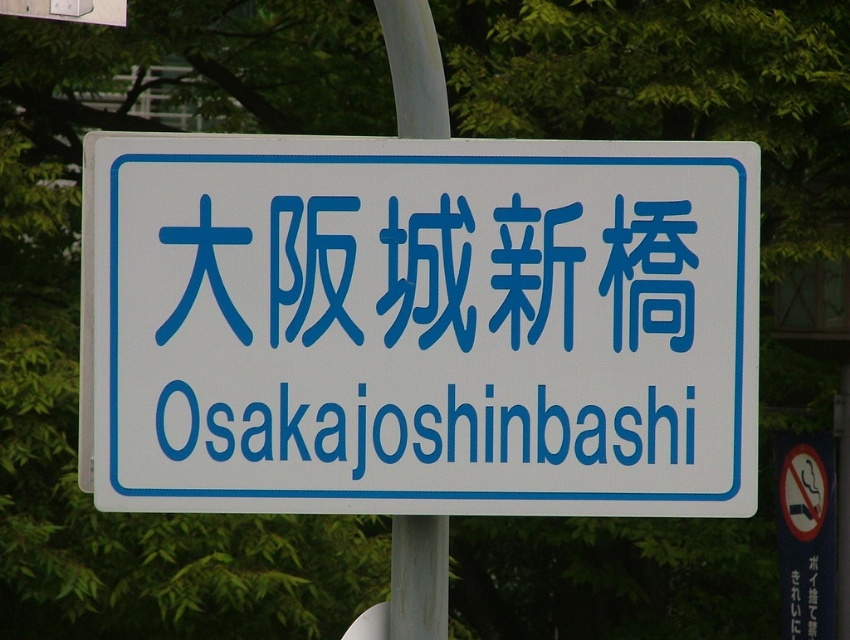
Question: Based on their relative distances, which object is farther from the white plastic signboard at center?

Choices:
 (A) bluematerial/texturetext at center
 (B) metallic gray pole at center
 (C) blue plastic sign at center

Answer: (C)

Question: Which point is closer to the camera?

Choices:
 (A) metallic gray pole at center
 (B) blue plastic sign at center
 (C) bluematerial/texturetext at center
 (D) white plastic signboard at center

Answer: (D)

Question: Does metallic gray pole at center have a lesser width compared to blue plastic sign at center?

Choices:
 (A) yes
 (B) no

Answer: (A)

Question: Which object appears closest to the camera in this image?

Choices:
 (A) white plastic signboard at center
 (B) blue plastic sign at center
 (C) metallic gray pole at center

Answer: (A)

Question: In this image, where is white plastic signboard at center located relative to bluematerial/texturetext at center?

Choices:
 (A) above
 (B) below

Answer: (A)

Question: Is white plastic signboard at center positioned in front of bluematerial/texturetext at center?

Choices:
 (A) no
 (B) yes

Answer: (B)